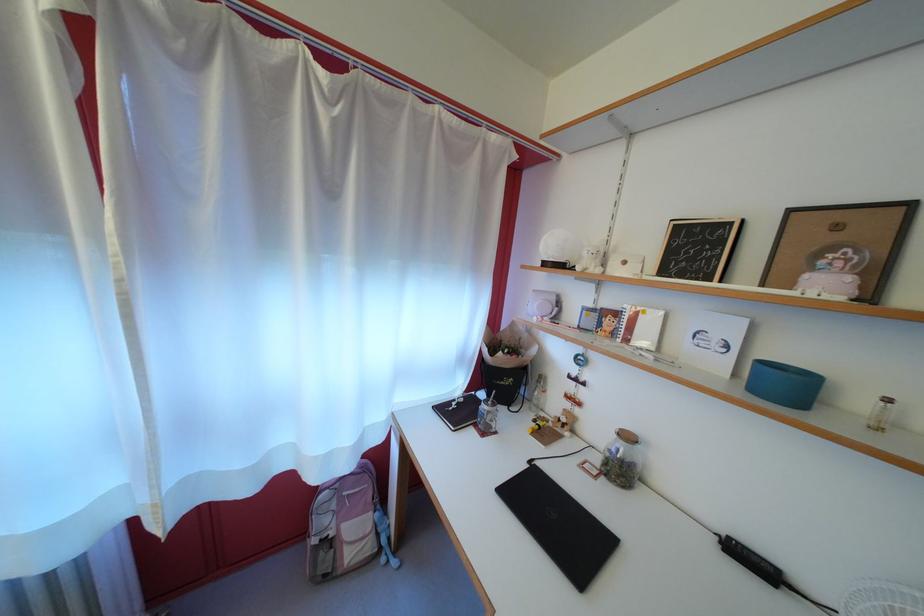
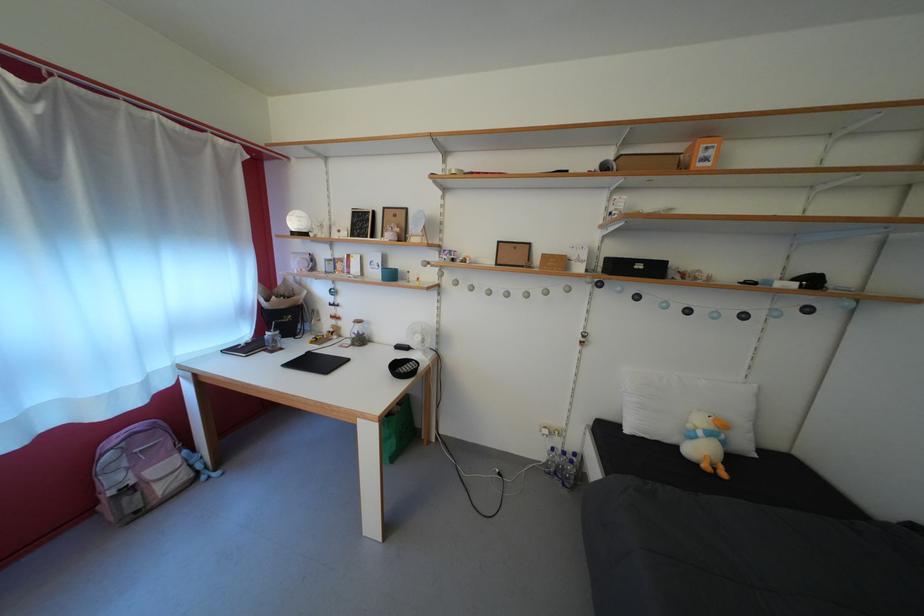
Find the pixel in the second image that matches pixel 331 529 in the first image.

(123, 485)